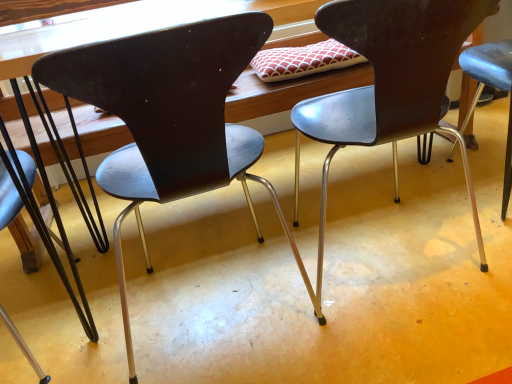
You are a GUI agent. You are given a task and a screenshot of the screen. Output one action in this format:
    pyautogui.click(x=<x>, y=<y>)
    Task: Click on the metallic dark brown chair at left, which is the 1th chair in left-to-right order
    The width and height of the screenshot is (512, 384).
    Given the screenshot: What is the action you would take?
    pyautogui.click(x=8, y=198)

The image size is (512, 384). Find the location of `metallic black chair at center, acting as the 1th chair starting from the right`. metallic black chair at center, acting as the 1th chair starting from the right is located at coordinates (389, 84).

From the picture: Are matte black chair at center, the second chair positioned from the left, and metallic black chair at center, acting as the 1th chair starting from the right, located far from each other?

Actually, matte black chair at center, the second chair positioned from the left, and metallic black chair at center, acting as the 1th chair starting from the right, are a little close together.

Could you tell me if matte black chair at center, the second chair viewed from the right, is facing metallic black chair at center, acting as the 1th chair starting from the right?

No, matte black chair at center, the second chair viewed from the right, is not aimed at metallic black chair at center, acting as the 1th chair starting from the right.

From the picture: From a real-world perspective, is matte black chair at center, the second chair positioned from the left, over metallic black chair at center, acting as the 1th chair starting from the right?

Yes.

From the image's perspective, is matte black chair at center, the second chair viewed from the right, above metallic black chair at center, acting as the 1th chair starting from the right?

No, from the image's perspective, matte black chair at center, the second chair viewed from the right, is not above metallic black chair at center, acting as the 1th chair starting from the right.

Is metallic black chair at center, acting as the 1th chair starting from the right, thinner than matte black chair at center, the second chair positioned from the left?

Yes.

Is the surface of metallic black chair at center, acting as the 1th chair starting from the right, in direct contact with matte black chair at center, the second chair positioned from the left?

metallic black chair at center, acting as the 1th chair starting from the right, and matte black chair at center, the second chair positioned from the left, are clearly separated.

In the scene shown: Is metallic black chair at center, acting as the 1th chair starting from the right, not within matte black chair at center, the second chair viewed from the right?

Yes.

Relative to matte black chair at center, the second chair viewed from the right, is metallic black chair at center, which is the 3th chair from left to right, in front or behind?

metallic black chair at center, which is the 3th chair from left to right, is behind matte black chair at center, the second chair viewed from the right.

Is metallic dark brown chair at left, the 3th chair in the right-to-left sequence, closer to camera compared to metallic black chair at center, which is the 3th chair from left to right?

No, it is not.

Could you tell me if metallic dark brown chair at left, which is the 1th chair in left-to-right order, is turned towards metallic black chair at center, acting as the 1th chair starting from the right?

Yes, metallic dark brown chair at left, which is the 1th chair in left-to-right order, is facing metallic black chair at center, acting as the 1th chair starting from the right.

Consider the image. From the image's perspective, which object appears higher, metallic dark brown chair at left, which is the 1th chair in left-to-right order, or metallic black chair at center, acting as the 1th chair starting from the right?

→ metallic black chair at center, acting as the 1th chair starting from the right, appears higher in the image.

Based on the photo, in the image, is metallic dark brown chair at left, the 3th chair in the right-to-left sequence, on the left side or the right side of metallic black chair at center, acting as the 1th chair starting from the right?

metallic dark brown chair at left, the 3th chair in the right-to-left sequence, is to the left of metallic black chair at center, acting as the 1th chair starting from the right.

From the image's perspective, is metallic dark brown chair at left, which is the 1th chair in left-to-right order, positioned above or below matte black chair at center, the second chair viewed from the right?

metallic dark brown chair at left, which is the 1th chair in left-to-right order, is situated lower than matte black chair at center, the second chair viewed from the right, in the image.

Between metallic dark brown chair at left, which is the 1th chair in left-to-right order, and matte black chair at center, the second chair positioned from the left, which one is positioned behind?

Positioned behind is metallic dark brown chair at left, which is the 1th chair in left-to-right order.

Consider the image. How different are the orientations of metallic dark brown chair at left, the 3th chair in the right-to-left sequence, and matte black chair at center, the second chair viewed from the right, in degrees?

The facing directions of metallic dark brown chair at left, the 3th chair in the right-to-left sequence, and matte black chair at center, the second chair viewed from the right, are 90 degrees apart.

From a real-world perspective, which is physically above, metallic dark brown chair at left, the 3th chair in the right-to-left sequence, or matte black chair at center, the second chair positioned from the left?

In real-world perspective, matte black chair at center, the second chair positioned from the left, is above.

Who is bigger, matte black chair at center, the second chair positioned from the left, or metallic dark brown chair at left, the 3th chair in the right-to-left sequence?

matte black chair at center, the second chair positioned from the left.

From a real-world perspective, relative to metallic dark brown chair at left, the 3th chair in the right-to-left sequence, is matte black chair at center, the second chair viewed from the right, vertically above or below?

From a real-world perspective, matte black chair at center, the second chair viewed from the right, is physically above metallic dark brown chair at left, the 3th chair in the right-to-left sequence.

From the picture: From the image's perspective, relative to metallic dark brown chair at left, which is the 1th chair in left-to-right order, is matte black chair at center, the second chair viewed from the right, above or below?

From the image's perspective, matte black chair at center, the second chair viewed from the right, appears above metallic dark brown chair at left, which is the 1th chair in left-to-right order.

Is point (201, 52) farther from viewer compared to point (18, 210)?

No, it is not.

From the image's perspective, is metallic black chair at center, which is the 3th chair from left to right, located above metallic dark brown chair at left, the 3th chair in the right-to-left sequence?

Yes, from the image's perspective, metallic black chair at center, which is the 3th chair from left to right, is above metallic dark brown chair at left, the 3th chair in the right-to-left sequence.

Is metallic black chair at center, which is the 3th chair from left to right, inside the boundaries of metallic dark brown chair at left, the 3th chair in the right-to-left sequence, or outside?

metallic black chair at center, which is the 3th chair from left to right, is not enclosed by metallic dark brown chair at left, the 3th chair in the right-to-left sequence.

Is metallic black chair at center, acting as the 1th chair starting from the right, with metallic dark brown chair at left, which is the 1th chair in left-to-right order?

No, metallic black chair at center, acting as the 1th chair starting from the right, is not in contact with metallic dark brown chair at left, which is the 1th chair in left-to-right order.

Does point (355, 41) lie in front of point (5, 178)?

Yes, it is.

Locate an element on the screen. chair above the metallic black chair at center, which is the 3th chair from left to right (from a real-world perspective) is located at coordinates (170, 119).

Identify the location of the 1st chair behind when counting from the matte black chair at center, the second chair viewed from the right. The width and height of the screenshot is (512, 384). (389, 84).

Which object lies further to the anchor point matte black chair at center, the second chair positioned from the left, metallic black chair at center, acting as the 1th chair starting from the right, or metallic dark brown chair at left, which is the 1th chair in left-to-right order?

metallic dark brown chair at left, which is the 1th chair in left-to-right order.

Looking at the image, which one is located closer to metallic black chair at center, acting as the 1th chair starting from the right, metallic dark brown chair at left, which is the 1th chair in left-to-right order, or matte black chair at center, the second chair viewed from the right?

Among the two, matte black chair at center, the second chair viewed from the right, is located nearer to metallic black chair at center, acting as the 1th chair starting from the right.

Considering their positions, is matte black chair at center, the second chair viewed from the right, positioned closer to metallic dark brown chair at left, the 3th chair in the right-to-left sequence, than metallic black chair at center, acting as the 1th chair starting from the right?

matte black chair at center, the second chair viewed from the right, is closer to metallic dark brown chair at left, the 3th chair in the right-to-left sequence.

Which object lies nearer to the anchor point metallic dark brown chair at left, the 3th chair in the right-to-left sequence, metallic black chair at center, acting as the 1th chair starting from the right, or matte black chair at center, the second chair viewed from the right?

matte black chair at center, the second chair viewed from the right, is positioned closer to the anchor metallic dark brown chair at left, the 3th chair in the right-to-left sequence.

Based on their spatial positions, is metallic dark brown chair at left, the 3th chair in the right-to-left sequence, or metallic black chair at center, which is the 3th chair from left to right, closer to matte black chair at center, the second chair positioned from the left?

metallic black chair at center, which is the 3th chair from left to right.

Which object lies further to the anchor point metallic black chair at center, which is the 3th chair from left to right, matte black chair at center, the second chair positioned from the left, or metallic dark brown chair at left, which is the 1th chair in left-to-right order?

metallic dark brown chair at left, which is the 1th chair in left-to-right order, is further to metallic black chair at center, which is the 3th chair from left to right.

Find the location of `chair between metallic dark brown chair at left, the 3th chair in the right-to-left sequence, and metallic black chair at center, which is the 3th chair from left to right, from left to right`. chair between metallic dark brown chair at left, the 3th chair in the right-to-left sequence, and metallic black chair at center, which is the 3th chair from left to right, from left to right is located at coordinates (170, 119).